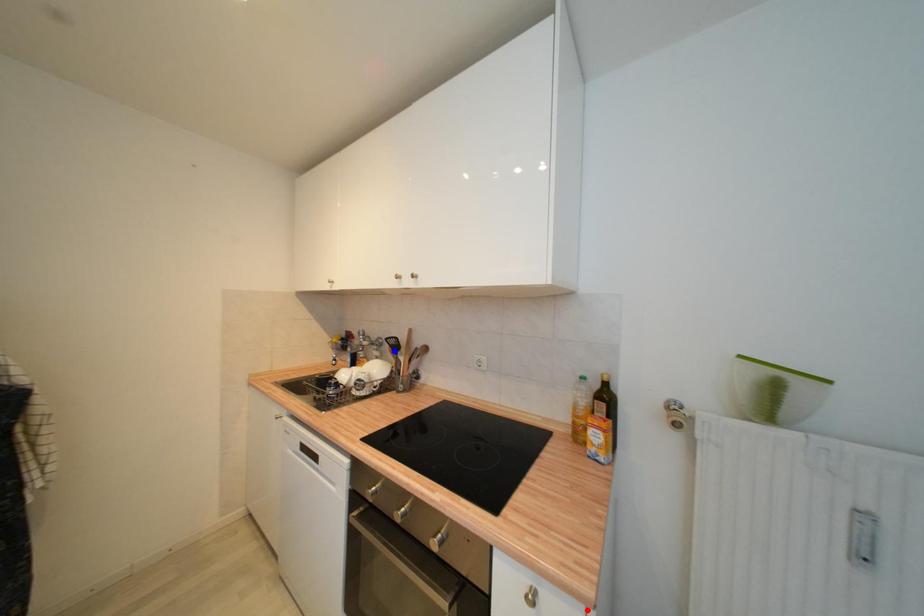
Question: Two points are marked on the image. Which point is closer to the camera?

Choices:
 (A) Blue point is closer.
 (B) Red point is closer.

Answer: (B)